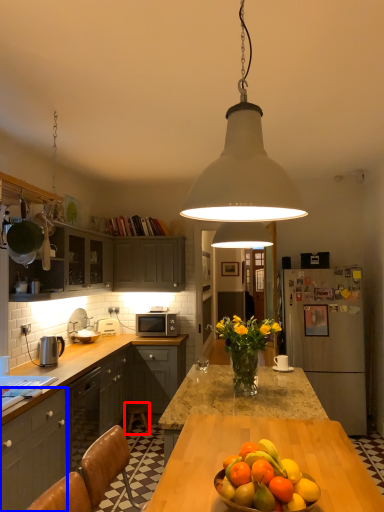
Question: Which point is further to the camera, chair (highlighted by a red box) or cabinetry (highlighted by a blue box)?

Choices:
 (A) chair
 (B) cabinetry

Answer: (A)